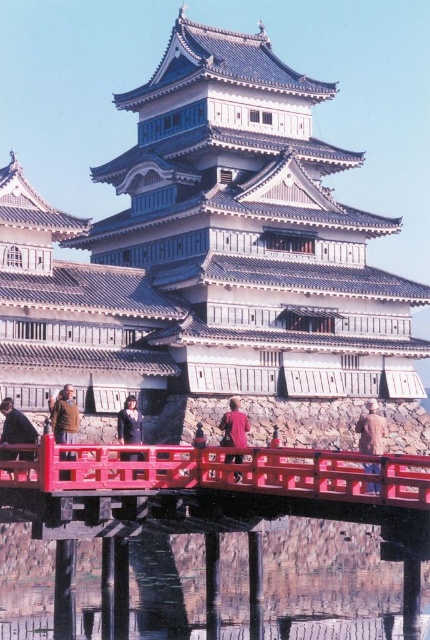
You are standing in front of the traditional Japanese castle and want to determine the position of two points marked on the red wooden bridge. Which point is closer to you, point [245,429] or point [197,422]?

Point [245,429] is closer to the viewer than point [197,422].

You are a tourist visiting the castle and want to cross the moat. You see the smooth wooden bridge at center and the matte black person at center. Which object is larger in size?

The smooth wooden bridge at center is bigger than the matte black person at center.

Consider the image. You are a visitor approaching the castle and see two people at the center of the scene. The red fabric person at center and the matte black person at center. Which one appears taller?

The red fabric person at center is taller than the matte black person at center.